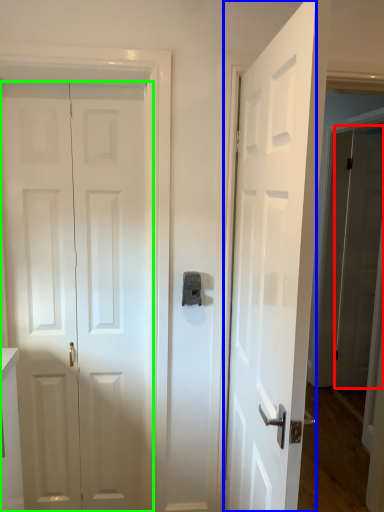
Question: Which is farther away from door (highlighted by a red box)? door (highlighted by a blue box) or door (highlighted by a green box)?

Choices:
 (A) door
 (B) door

Answer: (B)